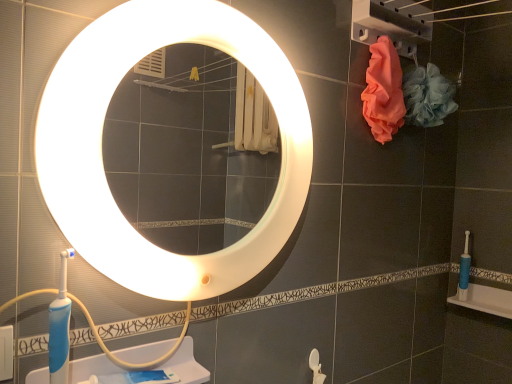
Question: Considering the relative positions of white glossy mirror at upper center and pink fabric at upper right in the image provided, is white glossy mirror at upper center to the right of pink fabric at upper right from the viewer's perspective?

Choices:
 (A) yes
 (B) no

Answer: (B)

Question: From a real-world perspective, does white glossy mirror at upper center stand above pink fabric at upper right?

Choices:
 (A) no
 (B) yes

Answer: (A)

Question: Is white glossy mirror at upper center completely or partially outside of pink fabric at upper right?

Choices:
 (A) yes
 (B) no

Answer: (A)

Question: Is white glossy mirror at upper center taller than pink fabric at upper right?

Choices:
 (A) yes
 (B) no

Answer: (A)

Question: Does white glossy mirror at upper center have a lesser height compared to pink fabric at upper right?

Choices:
 (A) no
 (B) yes

Answer: (A)

Question: From the image's perspective, is white glossy mirror at upper center over pink fabric at upper right?

Choices:
 (A) yes
 (B) no

Answer: (B)

Question: Considering the relative sizes of blue plastic toothbrush at lower right and blue plastic toothbrush at lower right in the image provided, is blue plastic toothbrush at lower right taller than blue plastic toothbrush at lower right?

Choices:
 (A) no
 (B) yes

Answer: (A)

Question: Does blue plastic toothbrush at lower right lie behind blue plastic toothbrush at lower right?

Choices:
 (A) no
 (B) yes

Answer: (A)

Question: From a real-world perspective, is blue plastic toothbrush at lower right on top of blue plastic toothbrush at lower right?

Choices:
 (A) yes
 (B) no

Answer: (B)

Question: Considering the relative positions of blue plastic toothbrush at lower right and blue plastic toothbrush at lower right in the image provided, is blue plastic toothbrush at lower right to the left of blue plastic toothbrush at lower right from the viewer's perspective?

Choices:
 (A) no
 (B) yes

Answer: (A)

Question: Does blue plastic toothbrush at lower right have a smaller size compared to blue plastic toothbrush at lower right?

Choices:
 (A) no
 (B) yes

Answer: (A)

Question: From a real-world perspective, is blue plastic toothbrush at lower right positioned under blue plastic toothbrush at lower right based on gravity?

Choices:
 (A) yes
 (B) no

Answer: (A)

Question: Is pink fabric at upper right taller than white plastic sink at lower left?

Choices:
 (A) no
 (B) yes

Answer: (B)